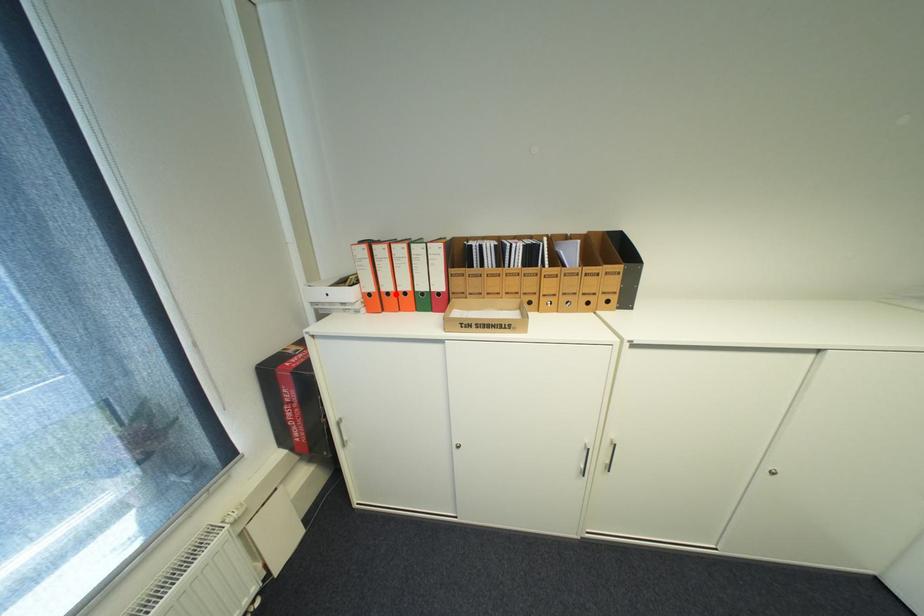
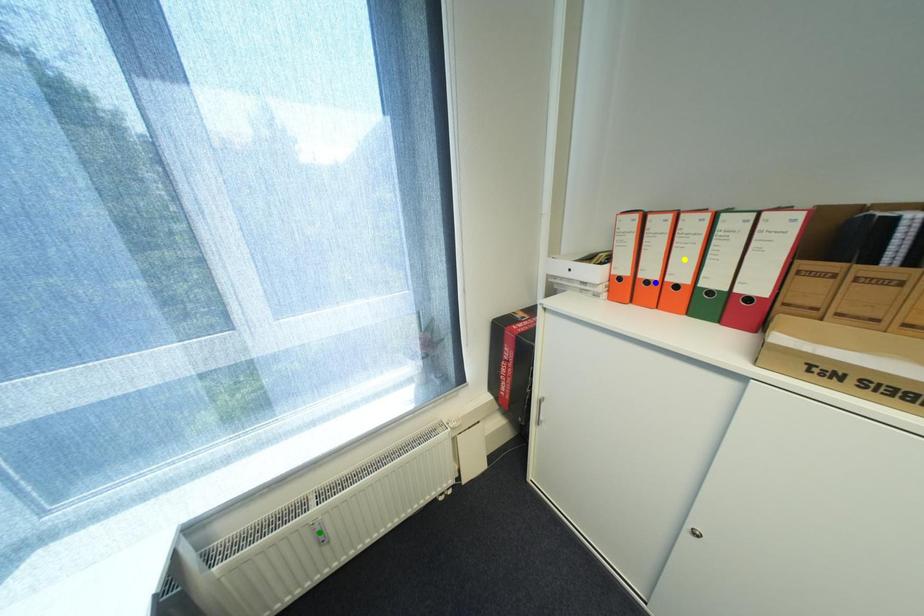
Question: I am providing you with two images of the same scene from different viewpoints. A red point is marked on the first image. You are given multiple points on the second image. Which point in image 2 represents the same 3d spot as the red point in image 1?

Choices:
 (A) green point
 (B) blue point
 (C) yellow point

Answer: (B)